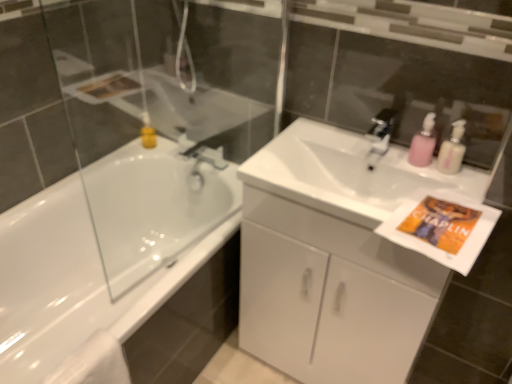
Image resolution: width=512 pixels, height=384 pixels. I want to click on pink plastic pump at upper right, so click(x=452, y=150).

Where is `white matte towel at lower left`? The height and width of the screenshot is (384, 512). white matte towel at lower left is located at coordinates (93, 362).

What is the approximate height of white glossy sink at center?

white glossy sink at center is 6.06 inches tall.

Where is `white glossy cabinet at center`? The width and height of the screenshot is (512, 384). white glossy cabinet at center is located at coordinates (330, 295).

You are a GUI agent. You are given a task and a screenshot of the screen. Output one action in this format:
    pyautogui.click(x=<x>, y=<y>)
    Task: Click on the silver metallic faucet at upper center
    
    Given the screenshot: What is the action you would take?
    pyautogui.click(x=380, y=136)

You are a GUI agent. You are given a task and a screenshot of the screen. Output one action in this format:
    pyautogui.click(x=<x>, y=<y>)
    Task: Click on the pink plastic pump at upper right
    This screenshot has height=384, width=512.
    Given the screenshot: What is the action you would take?
    pyautogui.click(x=452, y=150)

In the image, is silver metallic faucet at upper center positioned in front of or behind pink plastic soap dispenser at upper right?

silver metallic faucet at upper center is positioned farther from the viewer than pink plastic soap dispenser at upper right.

From the image's perspective, relative to pink plastic soap dispenser at upper right, is silver metallic faucet at upper center above or below?

Clearly, from the image's perspective, silver metallic faucet at upper center is above pink plastic soap dispenser at upper right.

Does silver metallic faucet at upper center have a larger size compared to pink plastic soap dispenser at upper right?

Correct, silver metallic faucet at upper center is larger in size than pink plastic soap dispenser at upper right.

Considering the positions of objects silver metallic faucet at upper center and white matte towel at lower left in the image provided, who is more to the left, silver metallic faucet at upper center or white matte towel at lower left?

white matte towel at lower left is more to the left.

From a real-world perspective, between silver metallic faucet at upper center and white matte towel at lower left, who is vertically lower?

white matte towel at lower left.

This screenshot has width=512, height=384. I want to click on tap above the white matte towel at lower left (from the image's perspective), so click(x=380, y=136).

Which is behind, white glossy bathtub at left or pink plastic soap dispenser at upper right?

pink plastic soap dispenser at upper right is behind.

Considering the sizes of white glossy bathtub at left and pink plastic soap dispenser at upper right in the image, is white glossy bathtub at left taller or shorter than pink plastic soap dispenser at upper right?

In the image, white glossy bathtub at left appears to be taller than pink plastic soap dispenser at upper right.

Based on the photo, from the image's perspective, is white glossy bathtub at left positioned above or below pink plastic soap dispenser at upper right?

From the image's perspective, white glossy bathtub at left appears below pink plastic soap dispenser at upper right.

Can you confirm if white glossy bathtub at left is bigger than pink plastic soap dispenser at upper right?

Yes, white glossy bathtub at left is bigger than pink plastic soap dispenser at upper right.

In terms of width, does white glossy sink at center look wider or thinner when compared to white glossy bathtub at left?

Clearly, white glossy sink at center has less width compared to white glossy bathtub at left.

From the picture: Would you consider white glossy sink at center to be distant from white glossy bathtub at left?

They are positioned close to each other.

Would you say white glossy sink at center contains white glossy bathtub at left?

That's incorrect, white glossy bathtub at left is not inside white glossy sink at center.

How many degrees apart are the facing directions of white glossy sink at center and white glossy bathtub at left?

They differ by 89.3 degrees in their facing directions.

Can you confirm if white glossy sink at center is bigger than pink plastic pump at upper right?

Yes, white glossy sink at center is bigger than pink plastic pump at upper right.

Does white glossy sink at center lie behind pink plastic pump at upper right?

No, the depth of white glossy sink at center is less than that of pink plastic pump at upper right.

Who is shorter, white glossy sink at center or pink plastic pump at upper right?

pink plastic pump at upper right is shorter.

Is pink plastic pump at upper right oriented away from pink plastic soap dispenser at upper right?

No, pink plastic soap dispenser at upper right is not at the back of pink plastic pump at upper right.

How different are the orientations of pink plastic pump at upper right and pink plastic soap dispenser at upper right in degrees?

The facing directions of pink plastic pump at upper right and pink plastic soap dispenser at upper right are 0.585 degrees apart.

From the image's perspective, is pink plastic pump at upper right below pink plastic soap dispenser at upper right?

Yes, from the image's perspective, pink plastic pump at upper right is below pink plastic soap dispenser at upper right.

Is pink plastic pump at upper right to the left or to the right of pink plastic soap dispenser at upper right in the image?

pink plastic pump at upper right is positioned on pink plastic soap dispenser at upper right's right side.

Does white glossy bathtub at left have a larger size compared to white glossy sink at center?

Yes.

Consider the image. Which of these two, white glossy bathtub at left or white glossy sink at center, is thinner?

Thinner between the two is white glossy sink at center.

Between point (21, 325) and point (295, 168), which one is positioned behind?

Positioned behind is point (21, 325).

Which is more to the right, white glossy bathtub at left or white glossy sink at center?

white glossy sink at center is more to the right.

This screenshot has width=512, height=384. Find the location of `soap dispenser below the silver metallic faucet at upper center (from the image's perspective)`. soap dispenser below the silver metallic faucet at upper center (from the image's perspective) is located at coordinates (423, 143).

In the image, there is a silver metallic faucet at upper center. At what (x,y) coordinates should I click in order to perform the action: click on bath towel below it (from a real-world perspective). Please return your answer as a coordinate pair (x, y). The width and height of the screenshot is (512, 384). Looking at the image, I should click on (93, 362).

Which object lies nearer to the anchor point pink plastic soap dispenser at upper right, white glossy cabinet at center or pink plastic pump at upper right?

pink plastic pump at upper right is positioned closer to the anchor pink plastic soap dispenser at upper right.

In the scene shown: Estimate the real-world distances between objects in this image. Which object is further from white glossy cabinet at center, white glossy sink at center or pink plastic pump at upper right?

pink plastic pump at upper right is positioned further to the anchor white glossy cabinet at center.

Estimate the real-world distances between objects in this image. Which object is closer to white matte towel at lower left, white glossy sink at center or pink plastic pump at upper right?

The object closer to white matte towel at lower left is white glossy sink at center.

Looking at the image, which one is located further to pink plastic pump at upper right, white glossy sink at center or white glossy bathtub at left?

white glossy bathtub at left.

Considering their positions, is white glossy bathtub at left positioned closer to pink plastic soap dispenser at upper right than white glossy sink at center?

The object closer to pink plastic soap dispenser at upper right is white glossy sink at center.

Considering their positions, is white matte towel at lower left positioned further to silver metallic faucet at upper center than white glossy cabinet at center?

The object further to silver metallic faucet at upper center is white matte towel at lower left.

When comparing their distances from white glossy sink at center, does white matte towel at lower left or pink plastic soap dispenser at upper right seem closer?

pink plastic soap dispenser at upper right is closer to white glossy sink at center.

Looking at this image, considering their positions, is pink plastic pump at upper right positioned closer to white glossy bathtub at left than pink plastic soap dispenser at upper right?

Based on the image, pink plastic soap dispenser at upper right appears to be nearer to white glossy bathtub at left.

Find the location of `sink located between white matte towel at lower left and pink plastic pump at upper right in the left-right direction`. sink located between white matte towel at lower left and pink plastic pump at upper right in the left-right direction is located at coordinates (346, 174).

At what (x,y) coordinates should I click in order to perform the action: click on bath towel between white glossy bathtub at left and white glossy sink at center from left to right. Please return your answer as a coordinate pair (x, y). The height and width of the screenshot is (384, 512). Looking at the image, I should click on (93, 362).

At what (x,y) coordinates should I click in order to perform the action: click on sink between pink plastic pump at upper right and white glossy cabinet at center vertically. Please return your answer as a coordinate pair (x, y). The height and width of the screenshot is (384, 512). Looking at the image, I should click on (346, 174).

Where is `tap between white matte towel at lower left and pink plastic pump at upper right in the horizontal direction`? This screenshot has width=512, height=384. tap between white matte towel at lower left and pink plastic pump at upper right in the horizontal direction is located at coordinates (380, 136).